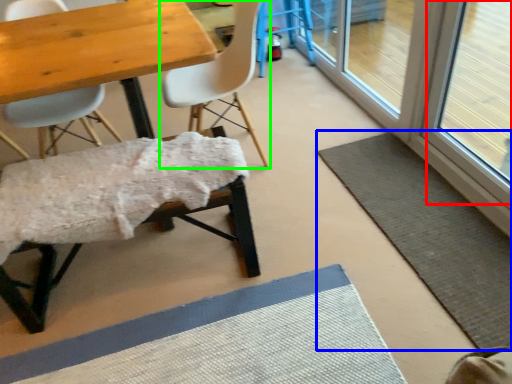
Question: Considering the real-world distances, which object is closest to window screen (highlighted by a red box)? bath mat (highlighted by a blue box) or chair (highlighted by a green box).

Choices:
 (A) bath mat
 (B) chair

Answer: (A)